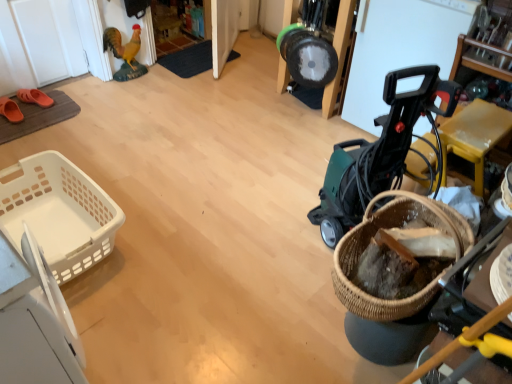
Locate an element on the screen. This screenshot has height=384, width=512. free point behind white plastic basket at left, placed as the 1th basket when sorted from left to right is located at coordinates (116, 163).